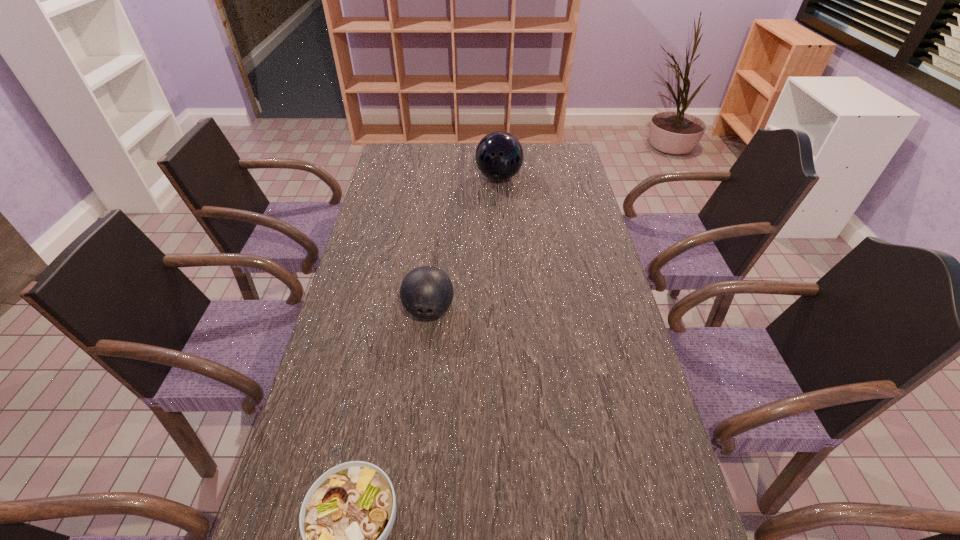
Identify the location of the taller bowling ball. Image resolution: width=960 pixels, height=540 pixels. (499, 156).

Find the location of a particular element. the rightmost object is located at coordinates 499,156.

I want to click on the second farthest object, so click(x=426, y=292).

Identify the location of the shorter bowling ball. Image resolution: width=960 pixels, height=540 pixels. (426, 292).

Where is `vacant region located 0.400m on the side of the rightmost object with the finger holes`? This screenshot has width=960, height=540. vacant region located 0.400m on the side of the rightmost object with the finger holes is located at coordinates (504, 262).

Identify the location of vacant space situated on the grip area of the left bowling ball. (412, 461).

Find the location of `object located in the far edge section of the desktop`. object located in the far edge section of the desktop is located at coordinates point(499,156).

In the image, there is a desktop. Identify the location of vacant area at the left edge. This screenshot has width=960, height=540. (360, 281).

This screenshot has height=540, width=960. What are the coordinates of `free space at the far right corner of the desktop` in the screenshot? It's located at (568, 163).

I want to click on vacant area that lies between the right bowling ball and the shorter bowling ball, so click(464, 244).